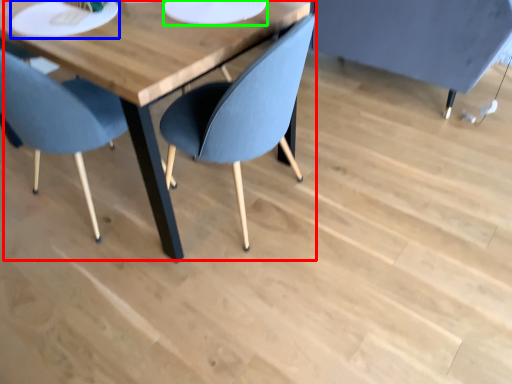
Question: Which is nearer to the table (highlighted by a red box)? platter (highlighted by a blue box) or paper plate (highlighted by a green box).

Choices:
 (A) platter
 (B) paper plate

Answer: (A)